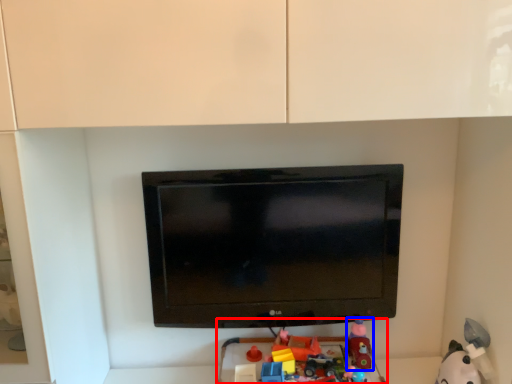
Question: Which object appears farthest to the camera in this image, toy (highlighted by a red box) or toy (highlighted by a blue box)?

Choices:
 (A) toy
 (B) toy

Answer: (B)